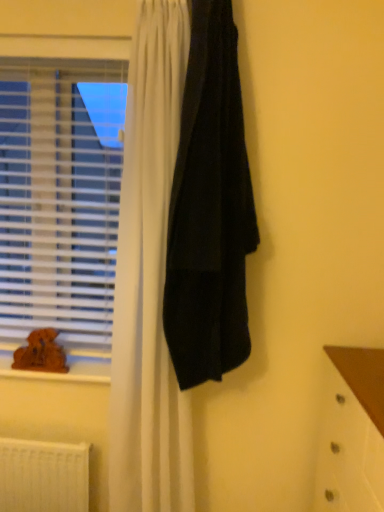
Question: From a real-world perspective, is white plastic radiator at lower left positioned above or below black matte towel at center?

Choices:
 (A) below
 (B) above

Answer: (A)

Question: Is white plastic radiator at lower left inside or outside of black matte towel at center?

Choices:
 (A) inside
 (B) outside

Answer: (B)

Question: Which object is the closest to the brown plush toy at lower left?

Choices:
 (A) black matte towel at center
 (B) brown wood at lower left
 (C) white plastic blinds at left
 (D) white plastic radiator at lower left

Answer: (B)

Question: Which of these objects is positioned farthest from the black matte towel at center?

Choices:
 (A) white plastic radiator at lower left
 (B) brown wood at lower left
 (C) white plastic blinds at left
 (D) brown plush toy at lower left

Answer: (A)